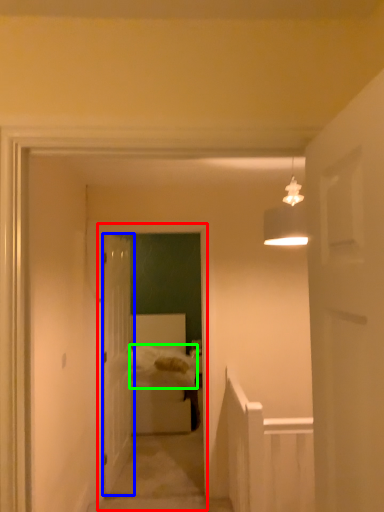
Question: Estimate the real-world distances between objects in this image. Which object is closer to corridor (highlighted by a red box), door (highlighted by a blue box) or sheet (highlighted by a green box)?

Choices:
 (A) door
 (B) sheet

Answer: (A)